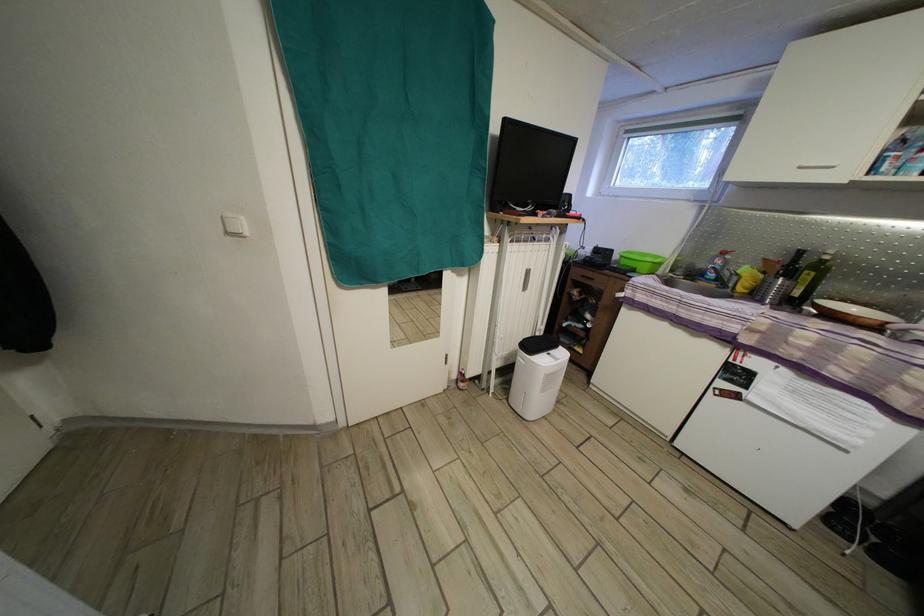
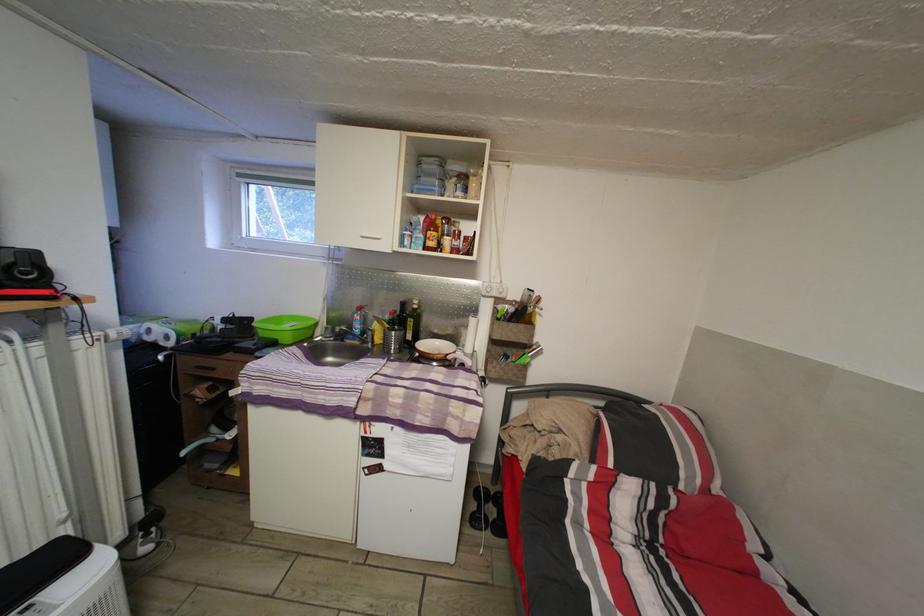
Find the pixel in the second image that matches point (804, 300) in the first image.

(417, 344)